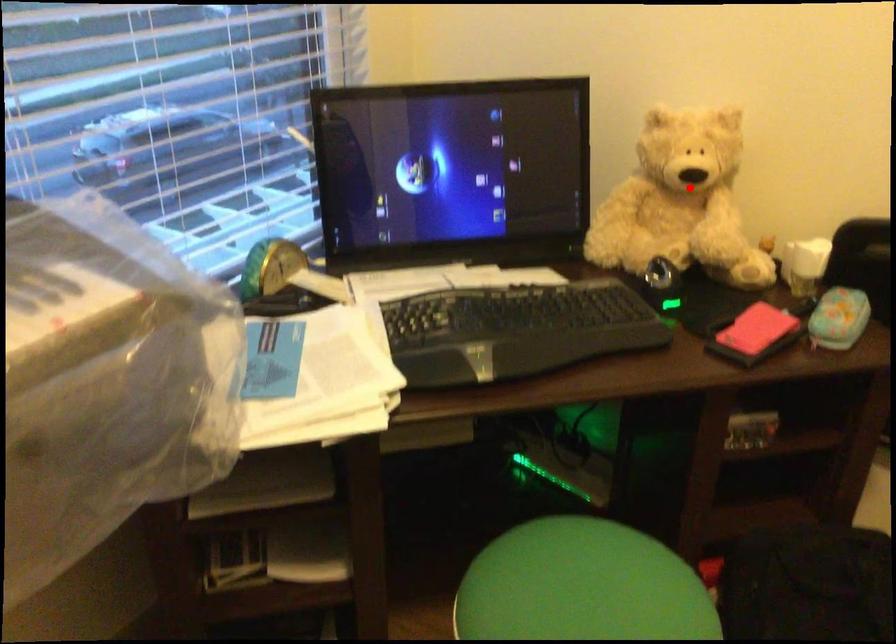
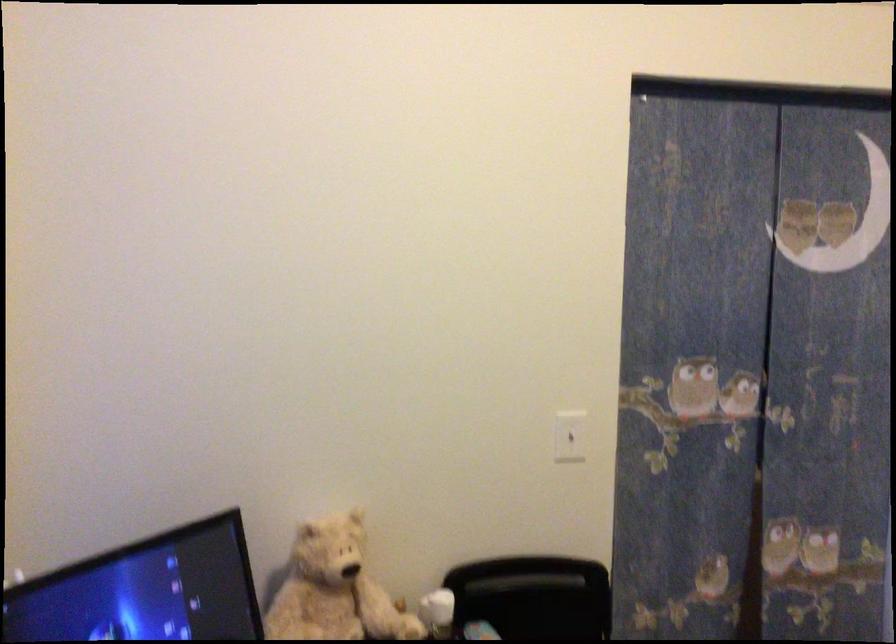
The point at the highlighted location is marked in the first image. Where is the corresponding point in the second image?

(334, 589)